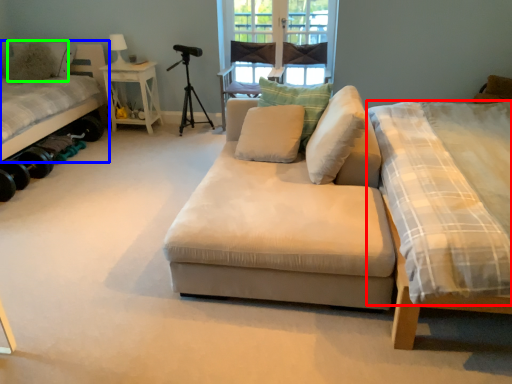
Question: Estimate the real-world distances between objects in this image. Which object is farther from mattress (highlighted by a red box), bed (highlighted by a blue box) or pillow (highlighted by a green box)?

Choices:
 (A) bed
 (B) pillow

Answer: (B)